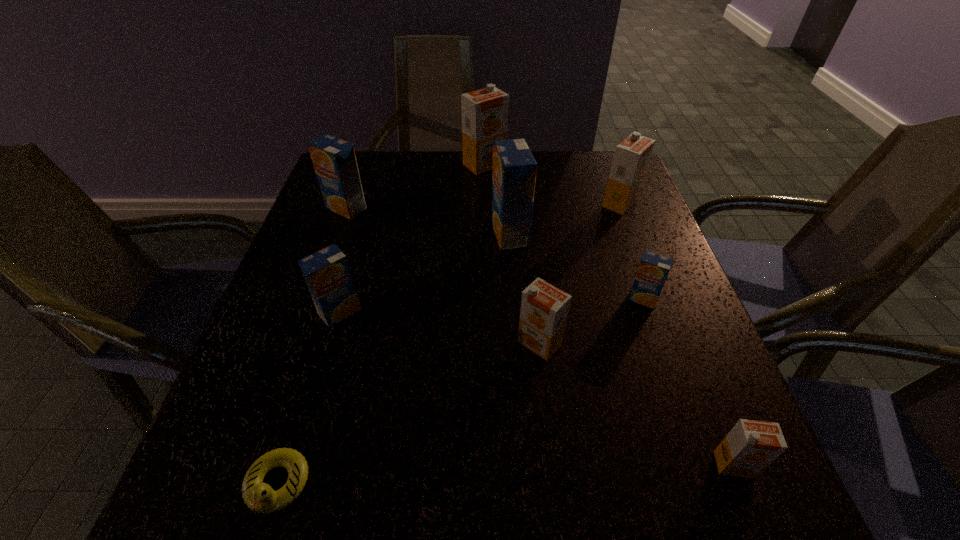
Locate an element on the screen. The image size is (960, 540). vacant space at the right edge of the desktop is located at coordinates [681, 318].

The height and width of the screenshot is (540, 960). What are the coordinates of `blank area at the far left corner` in the screenshot? It's located at (384, 166).

This screenshot has width=960, height=540. What are the coordinates of `empty space that is in between the second smallest orange orange juice and the farthest orange orange juice` in the screenshot? It's located at [512, 254].

Identify the location of free space between the duckling and the third biggest blue orange_juice. This screenshot has height=540, width=960. (308, 398).

The height and width of the screenshot is (540, 960). In order to click on vacant space in between the second smallest blue orange_juice and the farthest orange orange juice in this screenshot , I will do `click(412, 238)`.

Find the location of a particular element. The image size is (960, 540). free space between the second nearest orange orange juice and the yellow duckling is located at coordinates (408, 414).

Identify the location of empty space between the smallest blue orange_juice and the biggest blue orange_juice. (576, 266).

The width and height of the screenshot is (960, 540). Identify the location of vacant region between the farthest orange juice and the nearest orange juice. (609, 314).

Image resolution: width=960 pixels, height=540 pixels. I want to click on vacant area between the smallest orange orange juice and the third biggest blue orange_juice, so click(537, 388).

Image resolution: width=960 pixels, height=540 pixels. I want to click on free spot between the third smallest blue orange_juice and the duckling, so click(x=312, y=347).